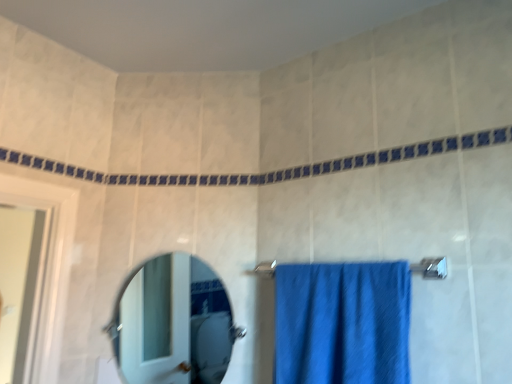
Question: Is polished silver mirror at center wider than blue fabric towel bar at center?

Choices:
 (A) no
 (B) yes

Answer: (A)

Question: Is polished silver mirror at center next to blue fabric towel bar at center and touching it?

Choices:
 (A) no
 (B) yes

Answer: (A)

Question: From the image's perspective, is polished silver mirror at center beneath blue fabric towel bar at center?

Choices:
 (A) no
 (B) yes

Answer: (B)

Question: From the image's perspective, does polished silver mirror at center appear higher than blue fabric towel bar at center?

Choices:
 (A) yes
 (B) no

Answer: (B)

Question: Is polished silver mirror at center looking in the opposite direction of blue fabric towel bar at center?

Choices:
 (A) no
 (B) yes

Answer: (A)

Question: Is polished silver mirror at center thinner than blue fabric towel bar at center?

Choices:
 (A) yes
 (B) no

Answer: (A)

Question: Is blue fabric towel at center closer to camera compared to polished silver mirror at center?

Choices:
 (A) no
 (B) yes

Answer: (B)

Question: From a real-world perspective, is blue fabric towel at center located higher than polished silver mirror at center?

Choices:
 (A) yes
 (B) no

Answer: (B)

Question: From the image's perspective, is blue fabric towel at center under polished silver mirror at center?

Choices:
 (A) yes
 (B) no

Answer: (B)

Question: Is polished silver mirror at center surrounded by blue fabric towel at center?

Choices:
 (A) yes
 (B) no

Answer: (B)

Question: Is blue fabric towel at center beside polished silver mirror at center?

Choices:
 (A) no
 (B) yes

Answer: (A)

Question: Can you confirm if blue fabric towel at center is positioned to the left of polished silver mirror at center?

Choices:
 (A) yes
 (B) no

Answer: (B)

Question: Considering the relative sizes of polished silver mirror at center and blue fabric towel at center in the image provided, is polished silver mirror at center shorter than blue fabric towel at center?

Choices:
 (A) no
 (B) yes

Answer: (A)